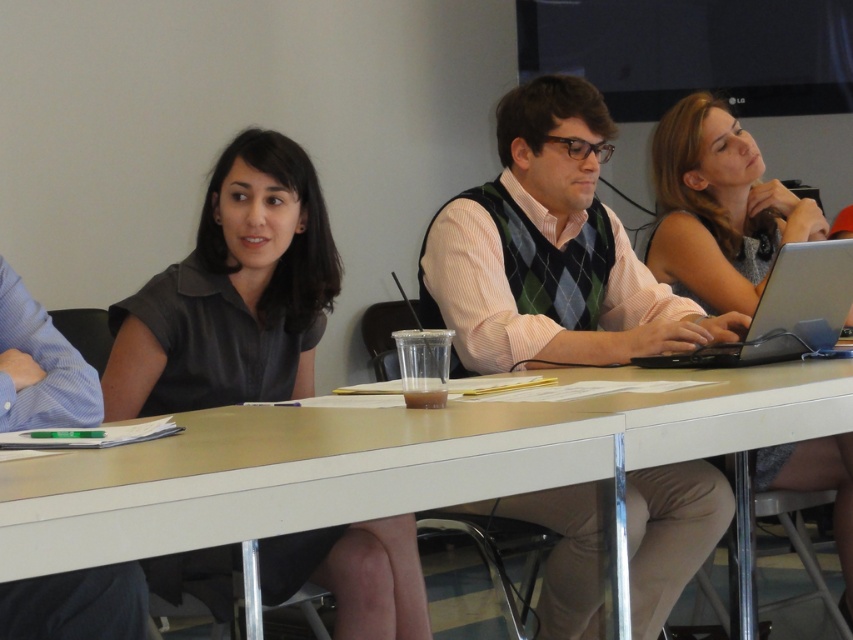
Between green argyle sweater vest at center and silver/black plastic laptop at center-right, which one has less height?

silver/black plastic laptop at center-right

Does green argyle sweater vest at center appear on the right side of silver/black plastic laptop at center-right?

No, green argyle sweater vest at center is not to the right of silver/black plastic laptop at center-right.

Which is behind, point (709, 340) or point (728, 355)?

The point (709, 340) is more distant.

You are a GUI agent. You are given a task and a screenshot of the screen. Output one action in this format:
    pyautogui.click(x=<x>, y=<y>)
    Task: Click on the green argyle sweater vest at center
    This screenshot has height=640, width=853.
    Given the screenshot: What is the action you would take?
    pyautogui.click(x=547, y=250)

Describe the element at coordinates (231, 292) in the screenshot. This screenshot has width=853, height=640. I see `dark gray shirt at center` at that location.

This screenshot has height=640, width=853. In order to click on dark gray shirt at center in this screenshot , I will do `click(231, 292)`.

Which is above, dark gray shirt at center or silver/black plastic laptop at center-right?

dark gray shirt at center is higher up.

Is dark gray shirt at center further to camera compared to silver/black plastic laptop at center-right?

Yes, dark gray shirt at center is further from the viewer.

Which is in front, point (306, 278) or point (780, 308)?

Positioned in front is point (780, 308).

Locate an element on the screen. The height and width of the screenshot is (640, 853). dark gray shirt at center is located at coordinates (231, 292).